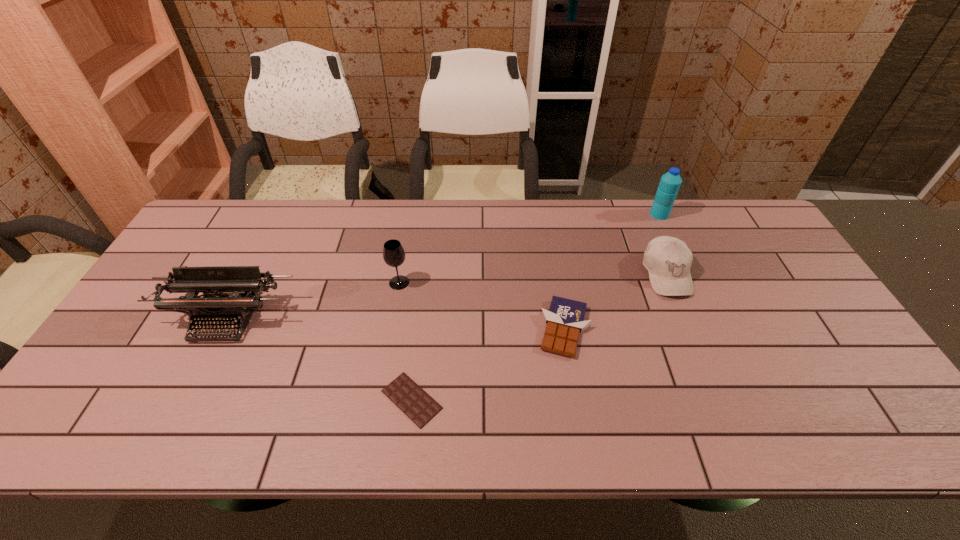
Find the location of a particular element. The height and width of the screenshot is (540, 960). vacant space located on the front of the wineglass is located at coordinates (391, 329).

The height and width of the screenshot is (540, 960). Find the location of `free location located on the typing side of the leftmost object`. free location located on the typing side of the leftmost object is located at coordinates [175, 421].

The width and height of the screenshot is (960, 540). I want to click on vacant space located on the front-facing side of the baseball cap, so click(x=725, y=416).

Image resolution: width=960 pixels, height=540 pixels. I want to click on vacant space positioned on the left of the fifth tallest object, so (481, 328).

At what (x,y) coordinates should I click in order to perform the action: click on free region located on the back of the nearest object. Please return your answer as a coordinate pair (x, y). Looking at the image, I should click on (424, 291).

I want to click on object positioned at the far edge, so click(x=670, y=182).

Identify the location of object present at the near edge. The height and width of the screenshot is (540, 960). (408, 396).

You are a GUI agent. You are given a task and a screenshot of the screen. Output one action in this format:
    pyautogui.click(x=<x>, y=<y>)
    Task: Click on the object present at the left edge
    The image size is (960, 540).
    Given the screenshot: What is the action you would take?
    pyautogui.click(x=243, y=283)

In order to click on vacant point at the far edge in this screenshot , I will do `click(461, 206)`.

The width and height of the screenshot is (960, 540). Find the location of `vacant region at the near edge of the desktop`. vacant region at the near edge of the desktop is located at coordinates (437, 422).